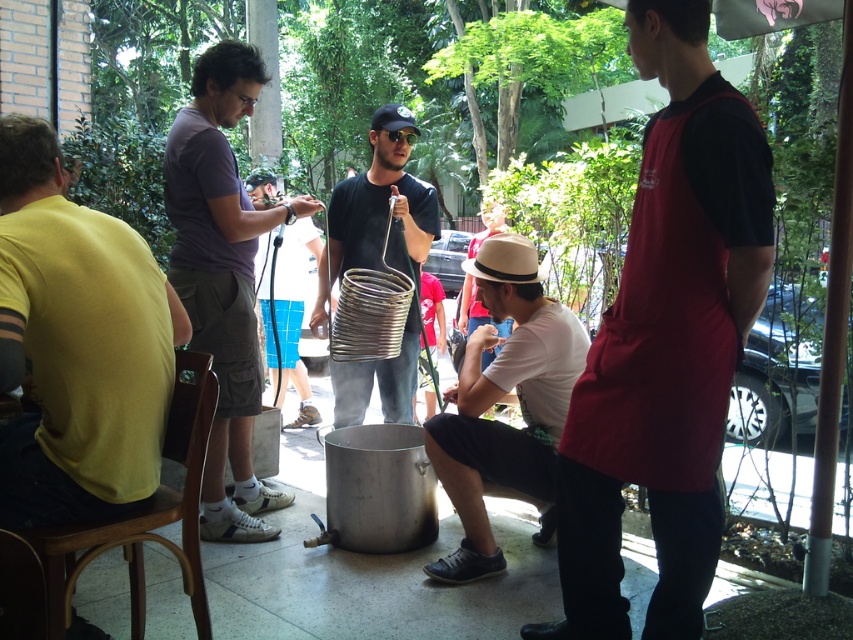
You are standing in the center of the image. Which direction should you move to reach the black matte apron at right?

Since the black matte apron at right is located at the right side of the image, you should move to the right to reach it.

You are a photographer at the event and want to capture a photo that includes both the yellow cotton shirt at left and the white cotton shirt at lower center. Which shirt should you focus on first to ensure both are in the frame?

The yellow cotton shirt at left is shorter than the white cotton shirt at lower center, so focus on the white cotton shirt at lower center first to ensure both are in the frame.

You are a photographer trying to capture a group photo of the dark purple shirt at left and the matte black shirt at center. Since you want to ensure both subjects are in focus, you need to know their heights. Which subject is taller?

The dark purple shirt at left has a greater height compared to matte black shirt at center, so the dark purple shirt at left is taller.